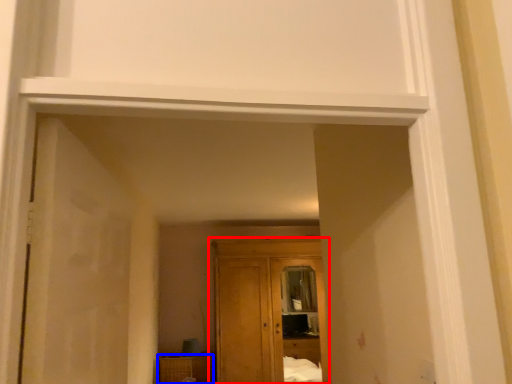
Question: Which point is closer to the camera, cupboard (highlighted by a red box) or cabinetry (highlighted by a blue box)?

Choices:
 (A) cupboard
 (B) cabinetry

Answer: (A)